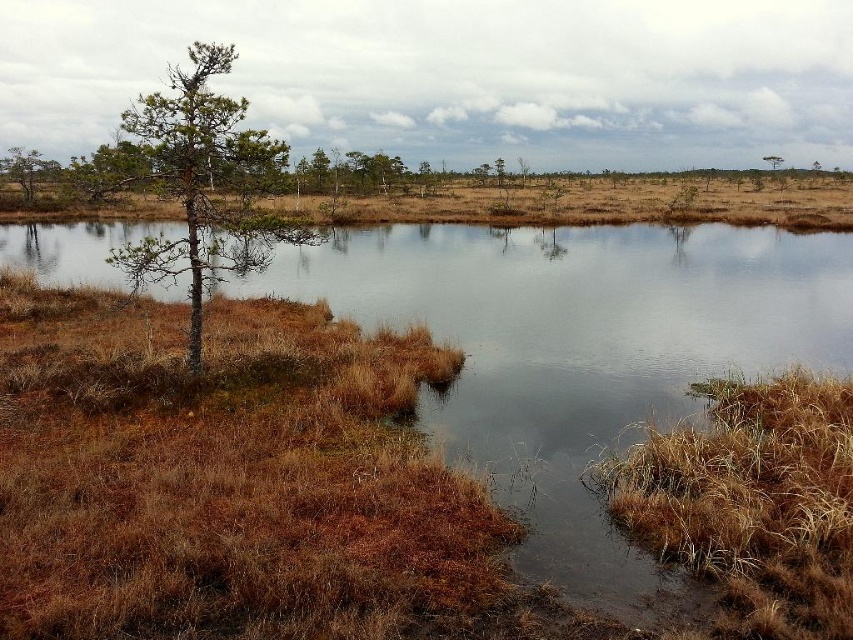
Which of these two, green matte tree at left or green matte tree at center, stands shorter?

With less height is green matte tree at center.

Which is behind, point (25, 150) or point (495, 161)?

Positioned behind is point (25, 150).

Is point (28, 148) positioned behind point (498, 179)?

Yes, point (28, 148) is behind point (498, 179).

This screenshot has height=640, width=853. Identify the location of green matte tree at left. pyautogui.click(x=27, y=170).

Which is in front, point (357, 317) or point (764, 160)?

Point (357, 317) is in front.

Who is more distant from viewer, (773,364) or (775,161)?

Positioned behind is point (775,161).

The height and width of the screenshot is (640, 853). I want to click on brown grassy lake at center, so click(x=579, y=346).

Does point (643, 355) lie in front of point (494, 164)?

That is True.

Which is more to the right, brown grassy lake at center or green matte tree at center?

Positioned to the right is green matte tree at center.

You are a GUI agent. You are given a task and a screenshot of the screen. Output one action in this format:
    pyautogui.click(x=<x>, y=<y>)
    Task: Click on the brown grassy lake at center
    
    Given the screenshot: What is the action you would take?
    pyautogui.click(x=579, y=346)

Find the location of `brown grassy lake at center`. brown grassy lake at center is located at coordinates (579, 346).